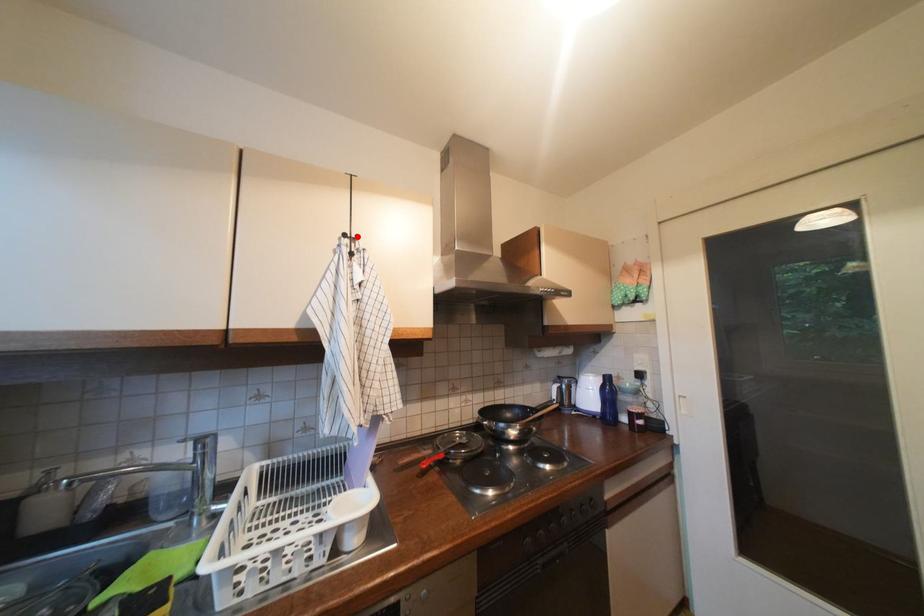
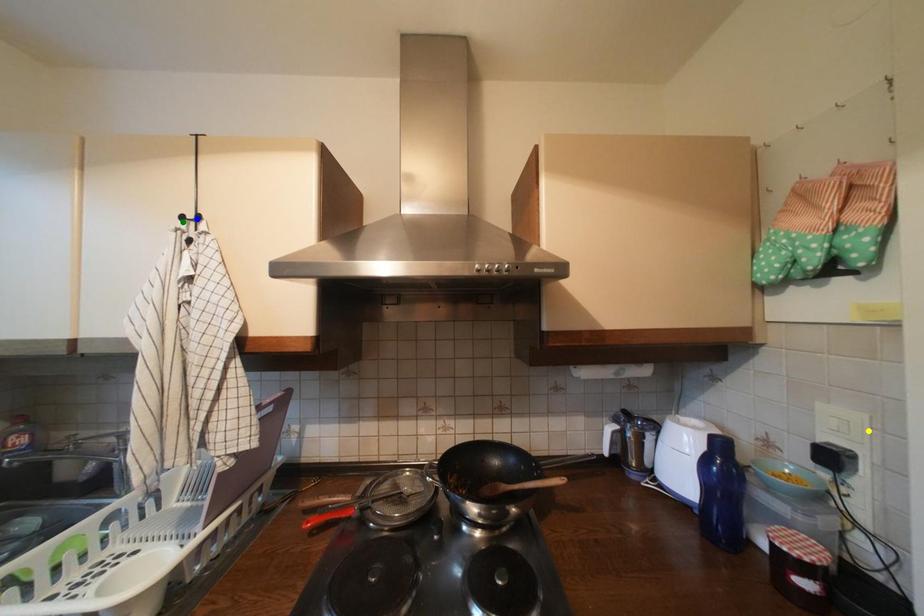
Question: I am providing you with two images of the same scene from different viewpoints. A red point is marked on the first image. You are given multiple points on the second image. Which spot in image 2 lines up with the point in image 1?

Choices:
 (A) green point
 (B) yellow point
 (C) blue point

Answer: (C)